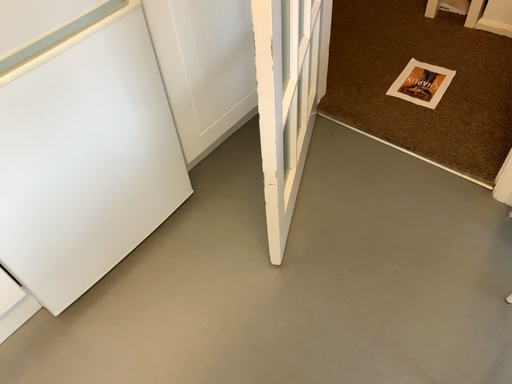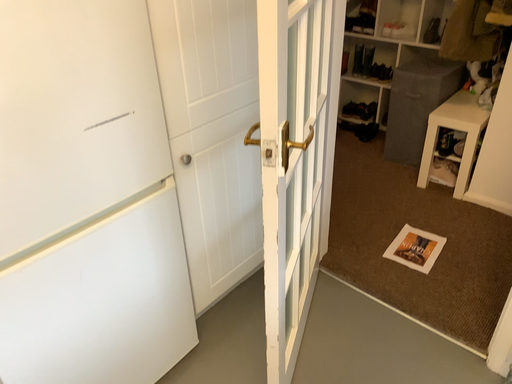
Question: Which way did the camera rotate in the video?

Choices:
 (A) rotated downward
 (B) rotated upward

Answer: (B)